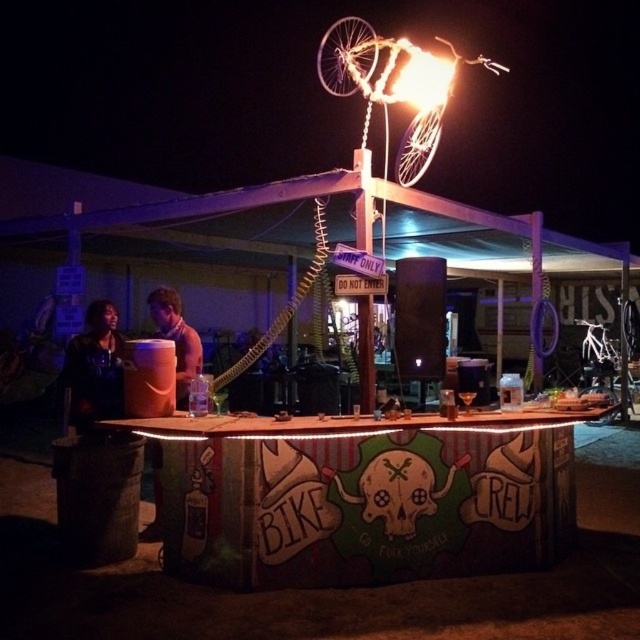
Question: Can you confirm if velvet black jacket at lower left is positioned to the right of white matte bicycle at center-right?

Choices:
 (A) no
 (B) yes

Answer: (A)

Question: Among these objects, which one is farthest from the camera?

Choices:
 (A) white matte bicycle at center-right
 (B) wooden barrel at center
 (C) velvet black jacket at lower left

Answer: (A)

Question: Does velvet black jacket at lower left appear over white matte bicycle at center-right?

Choices:
 (A) yes
 (B) no

Answer: (A)

Question: Does velvet black jacket at lower left appear on the right side of wooden barrel at center?

Choices:
 (A) no
 (B) yes

Answer: (A)

Question: Which object is farther from the camera taking this photo?

Choices:
 (A) white matte bicycle at center-right
 (B) wooden barrel at center

Answer: (A)

Question: Which of these objects is positioned closest to the velvet black jacket at lower left?

Choices:
 (A) wooden barrel at center
 (B) white matte bicycle at center-right

Answer: (A)